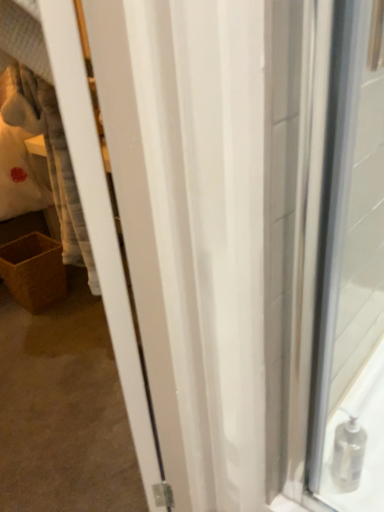
This screenshot has width=384, height=512. What are the coordinates of `vacant point to the right of brown woven basket at lower left` in the screenshot? It's located at (82, 303).